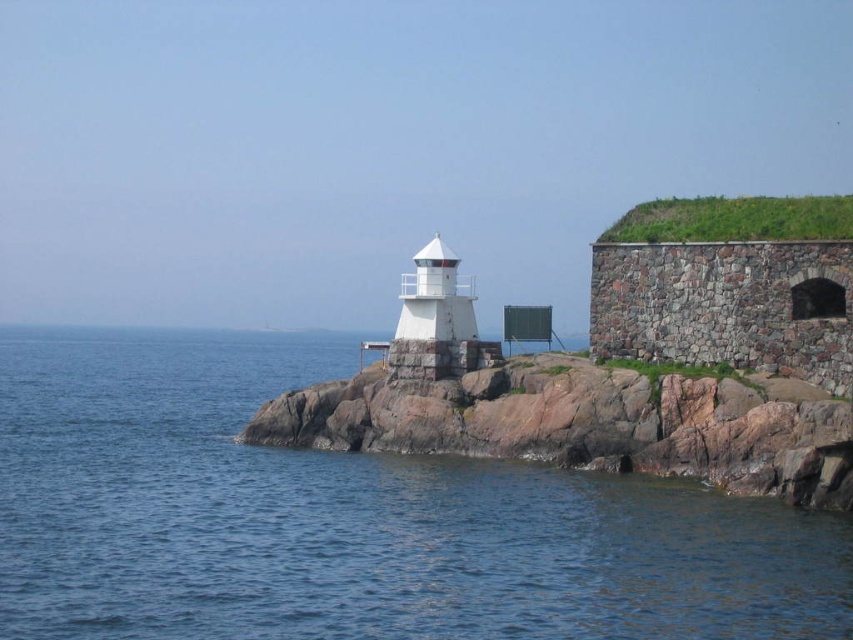
You are standing at the base of the lighthouse looking out towards the sea. There are two points marked on the rocky outcrop where you want to place safety markers. The first point is at coordinate point (451,513) and the second is at point (416,346). Which point is closer to you so that you can place the marker without needing to move further away?

Point (451,513) is closer to the viewer than point (416,346), so you can place the marker there without moving further away.

You are standing on a boat 50 meters away from the coast. You see the rockysmooth rockat center. Can you reach it without getting wet?

The rockysmooth rockat center is 47.40 meters away from viewer. Since you are on a boat 50 meters away from the coast, you are farther away than the rock, so you can reach it without getting wet by moving closer.

You are a painter planning to sketch the coastal scene. You notice the rockysmooth rockat center and the white stone lighthouse at center. Which object should you draw first if you want to depict the larger one first?

The rockysmooth rockat center should be drawn first because it has a larger size compared to the white stone lighthouse at center.